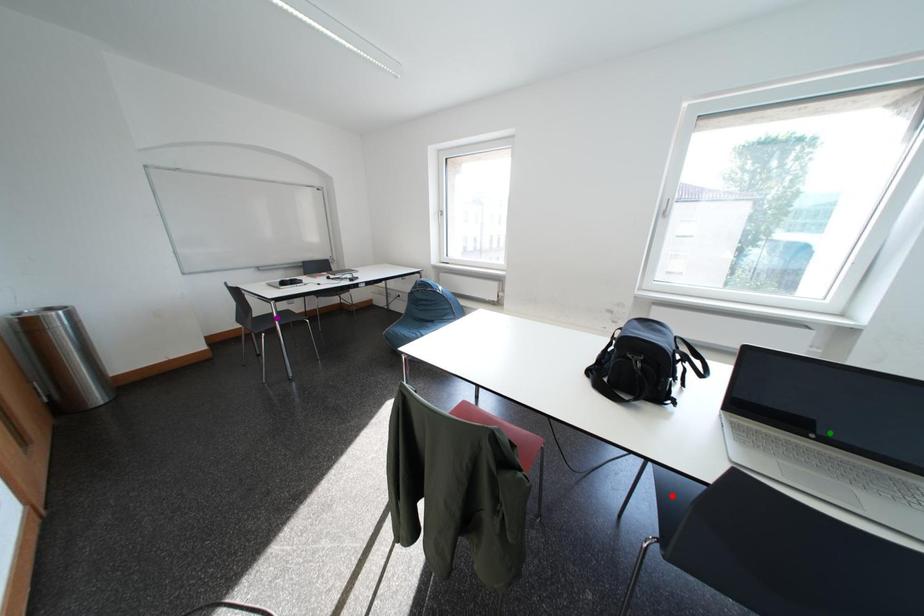
Order these from nearest to farthest:
purple point | green point | red point

1. green point
2. red point
3. purple point